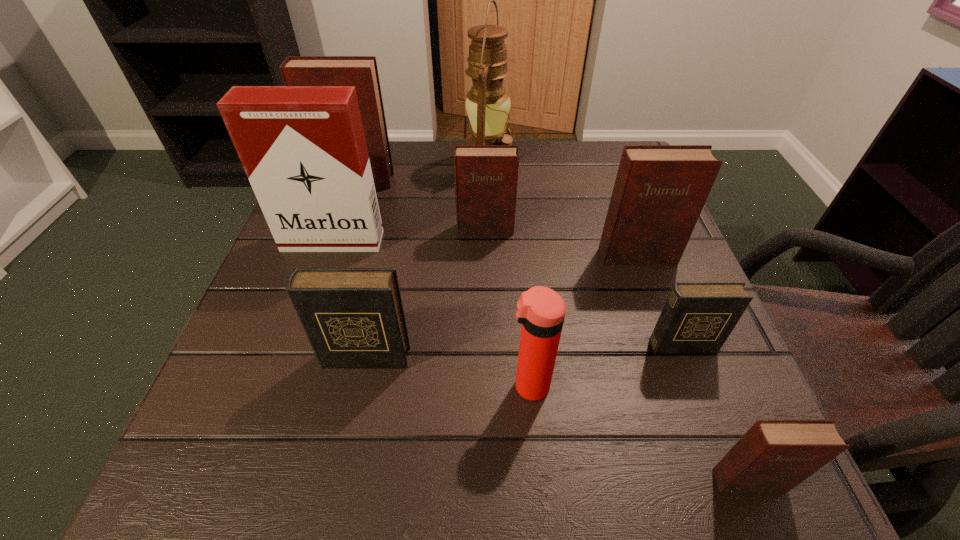
The width and height of the screenshot is (960, 540). Identify the location of free location located 0.150m on the front cover of the smaller dark diary. (721, 448).

Identify the location of oil lamp that is at the far edge. This screenshot has width=960, height=540. (488, 103).

The width and height of the screenshot is (960, 540). I want to click on diary that is at the far edge, so click(360, 71).

Find the location of a particular element. object located at the near edge is located at coordinates (773, 455).

You are a GUI agent. You are given a task and a screenshot of the screen. Output one action in this format:
    pyautogui.click(x=<x>, y=<y>)
    Task: Click on the cigarette_case that is at the left edge
    This screenshot has height=540, width=960.
    Given the screenshot: What is the action you would take?
    pyautogui.click(x=303, y=148)

Where is `object that is positioned at the far left corner`? This screenshot has height=540, width=960. object that is positioned at the far left corner is located at coordinates (360, 71).

This screenshot has height=540, width=960. Identify the location of object situated at the near right corner. (773, 455).

In the image, there is a desktop. What are the coordinates of `vacant space at the far edge` in the screenshot? It's located at (520, 159).

Where is `vacant space at the near edge of the desktop`? This screenshot has width=960, height=540. vacant space at the near edge of the desktop is located at coordinates (561, 462).

Locate an element on the screen. The height and width of the screenshot is (540, 960). vacant region at the left edge is located at coordinates (248, 329).